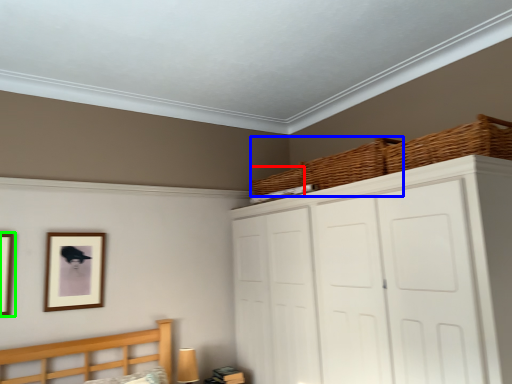
Question: Considering the real-world distances, which object is farthest from basket (highlighted by a red box)? basket (highlighted by a blue box) or picture frame (highlighted by a green box)?

Choices:
 (A) basket
 (B) picture frame

Answer: (B)